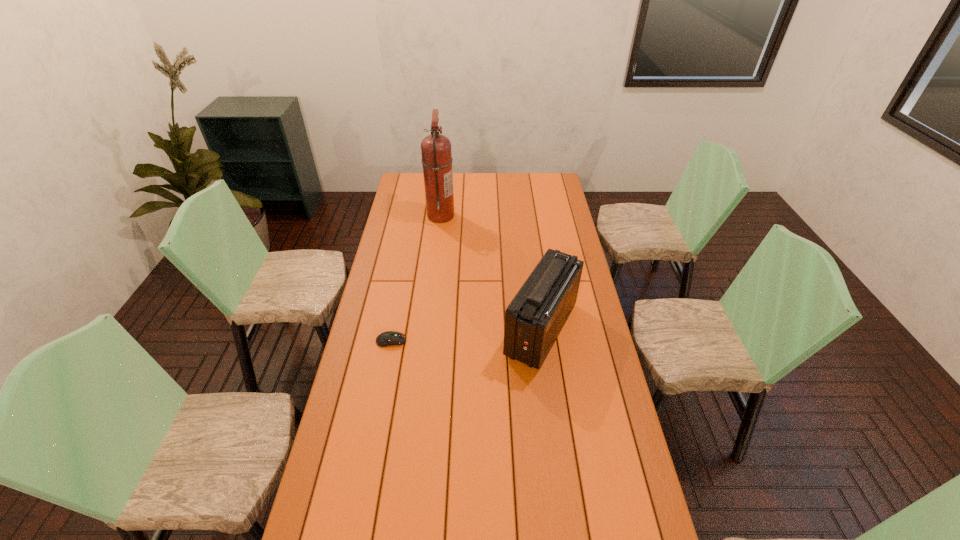
This screenshot has width=960, height=540. In order to click on vacant region between the leftmost object and the fire extinguisher in this screenshot , I will do `click(416, 278)`.

You are a GUI agent. You are given a task and a screenshot of the screen. Output one action in this format:
    pyautogui.click(x=<x>, y=<y>)
    Task: Click on the empty location between the second tallest object and the second object from right to left
    This screenshot has height=540, width=960.
    Given the screenshot: What is the action you would take?
    pyautogui.click(x=492, y=272)

Locate an element on the screen. The width and height of the screenshot is (960, 540). vacant area that lies between the leftmost object and the rightmost object is located at coordinates (466, 335).

Locate an element on the screen. Image resolution: width=960 pixels, height=540 pixels. object that is the closest to the second object from right to left is located at coordinates (533, 320).

Choose which object is the second nearest neighbor to the shortest object. Please provide its 2D coordinates. Your answer should be formatted as a tuple, i.e. [(x, y)], where the tuple contains the x and y coordinates of a point satisfying the conditions above.

[(436, 151)]